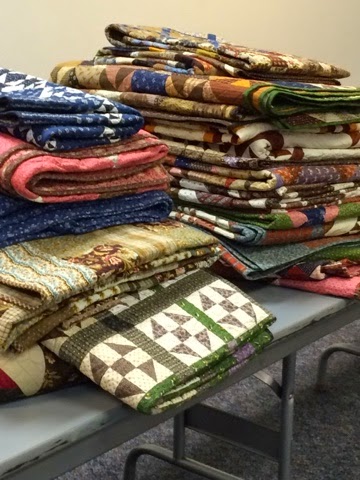
The image size is (360, 480). Find the location of `blue blanket under red blanket`. blue blanket under red blanket is located at coordinates (69, 222).